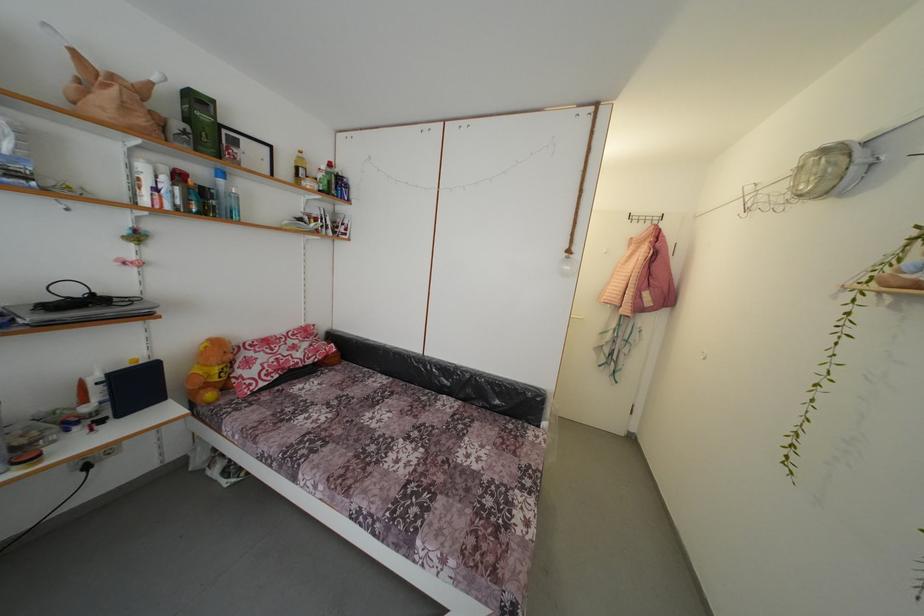
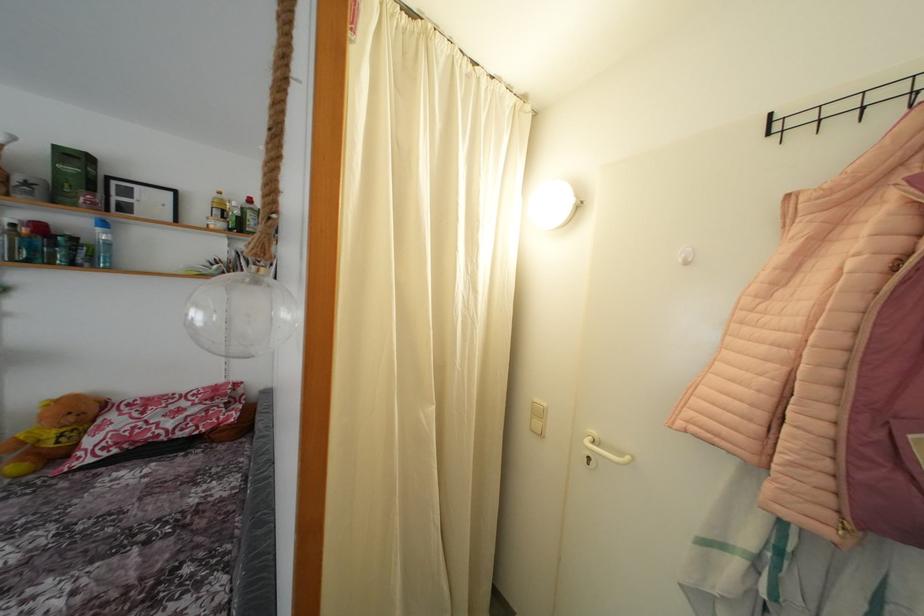
The point at (236, 362) is marked in the first image. Where is the corresponding point in the second image?

(77, 424)